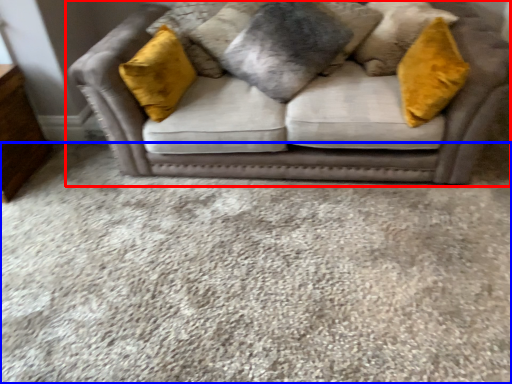
Question: Which object appears closest to the camera in this image, studio couch (highlighted by a red box) or plain (highlighted by a blue box)?

Choices:
 (A) studio couch
 (B) plain

Answer: (B)